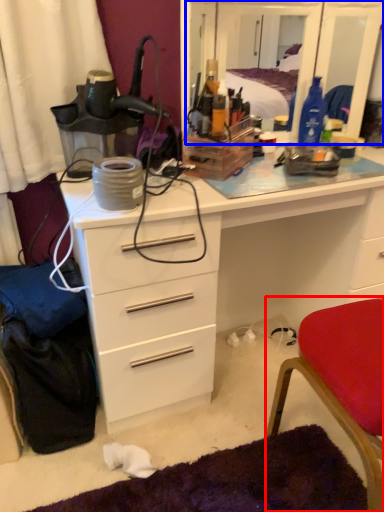
Question: Among these objects, which one is farthest to the camera, chair (highlighted by a red box) or mirror (highlighted by a blue box)?

Choices:
 (A) chair
 (B) mirror

Answer: (B)